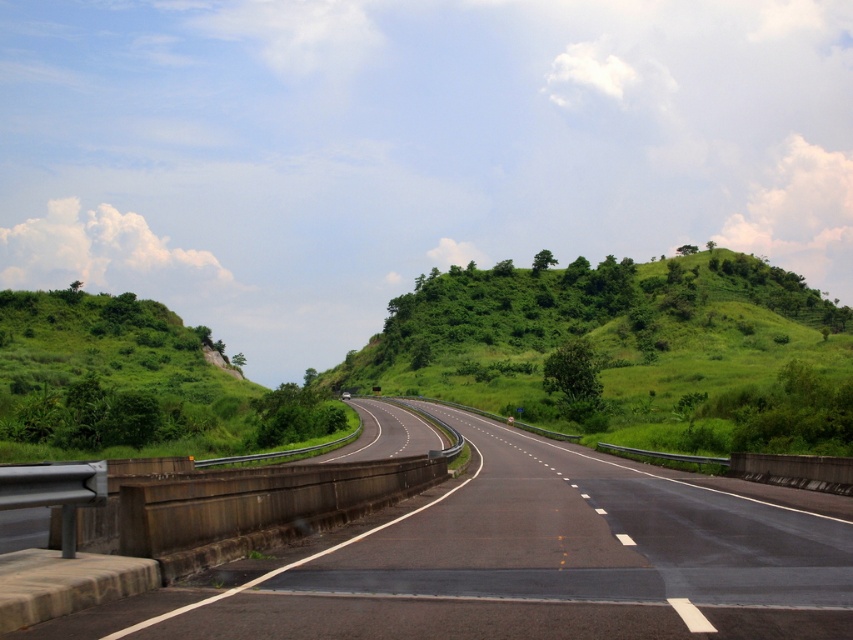
Question: Which object appears farthest from the camera in this image?

Choices:
 (A) green grassy hillside at center
 (B) black asphalt highway at center

Answer: (A)

Question: Among these objects, which one is farthest from the camera?

Choices:
 (A) green grassy hillside at center
 (B) black asphalt highway at center

Answer: (A)

Question: Considering the relative positions of black asphalt highway at center and green grassy hillside at center in the image provided, where is black asphalt highway at center located with respect to green grassy hillside at center?

Choices:
 (A) right
 (B) left

Answer: (B)

Question: Which point appears farthest from the camera in this image?

Choices:
 (A) (708, 513)
 (B) (718, 324)

Answer: (B)

Question: Is black asphalt highway at center bigger than green grassy hillside at center?

Choices:
 (A) no
 (B) yes

Answer: (A)

Question: Is black asphalt highway at center wider than green grassy hillside at center?

Choices:
 (A) yes
 (B) no

Answer: (B)